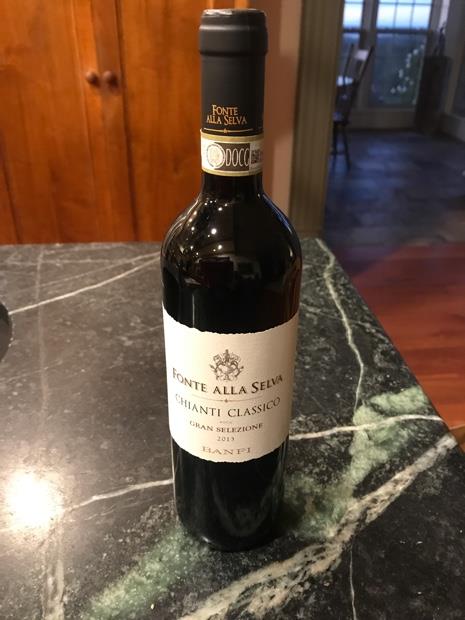
The height and width of the screenshot is (620, 465). I want to click on cork, so click(227, 12).